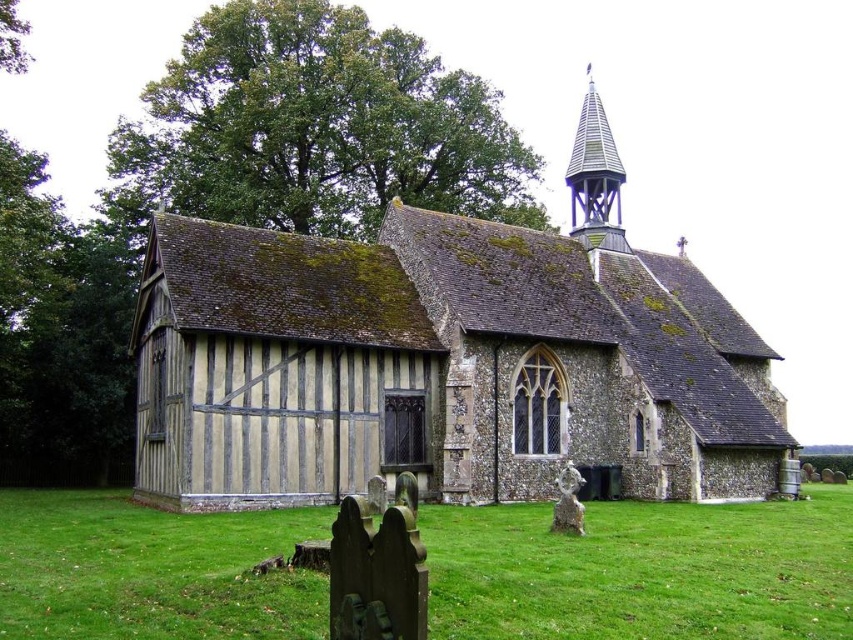
Can you confirm if wooden planks church at center is positioned to the left of shiny blue spire at upper right?

Correct, you'll find wooden planks church at center to the left of shiny blue spire at upper right.

Can you confirm if wooden planks church at center is positioned above shiny blue spire at upper right?

No.

Identify the location of wooden planks church at center. The image size is (853, 640). [439, 368].

You are a GUI agent. You are given a task and a screenshot of the screen. Output one action in this format:
    pyautogui.click(x=<x>, y=<y>)
    Task: Click on the wooden planks church at center
    Image resolution: width=853 pixels, height=640 pixels.
    Given the screenshot: What is the action you would take?
    pyautogui.click(x=439, y=368)

Measure the distance between green grass at lower center and shiny blue spire at upper right.

green grass at lower center is 46.26 meters away from shiny blue spire at upper right.

Is green grass at lower center positioned at the back of shiny blue spire at upper right?

No, green grass at lower center is closer to the viewer.

Locate an element on the screen. This screenshot has height=640, width=853. green grass at lower center is located at coordinates (643, 570).

Is point (749, 417) in front of point (509, 518)?

That is False.

Is point (653, 339) positioned after point (141, 595)?

Yes, point (653, 339) is behind point (141, 595).

Between point (735, 438) and point (131, 557), which one is positioned in front?

Point (131, 557)

Identify the location of wooden planks church at center. This screenshot has height=640, width=853. (439, 368).